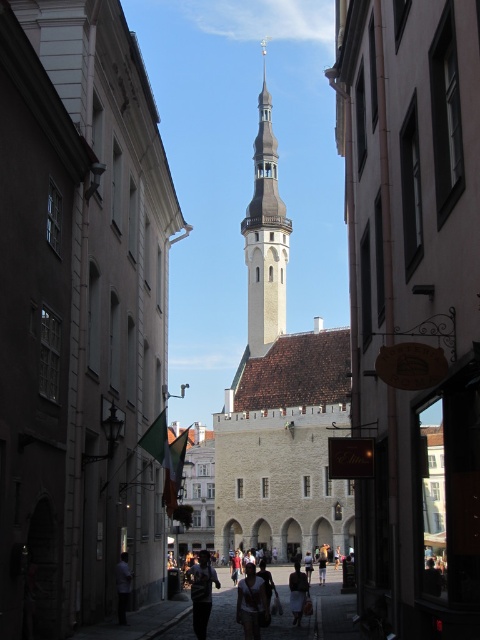
Does light brown leather jacket at center appear over matte black jacket at center?

Yes.

Is light brown leather jacket at center further to the viewer compared to matte black jacket at center?

No.

Between point (251, 566) and point (195, 612), which one is positioned behind?

Positioned behind is point (251, 566).

Locate an element on the screen. The height and width of the screenshot is (640, 480). light brown leather jacket at center is located at coordinates (251, 602).

Is white stone bell tower at center above light brown fabric skirt at center?

Correct, white stone bell tower at center is located above light brown fabric skirt at center.

Which is more to the right, white stone bell tower at center or light brown fabric skirt at center?

Positioned to the right is light brown fabric skirt at center.

What are the coordinates of `white stone bell tower at center` in the screenshot? It's located at (264, 236).

Find the location of a particular element. This screenshot has height=640, width=480. white stone bell tower at center is located at coordinates (264, 236).

Describe the element at coordinates (314, 611) in the screenshot. This screenshot has width=480, height=640. I see `light beige fabric dress at center` at that location.

Does light beige fabric dress at center have a greater width compared to light brown fabric skirt at center?

Yes, light beige fabric dress at center is wider than light brown fabric skirt at center.

Identify the location of light beige fabric dress at center. The image size is (480, 640). (314, 611).